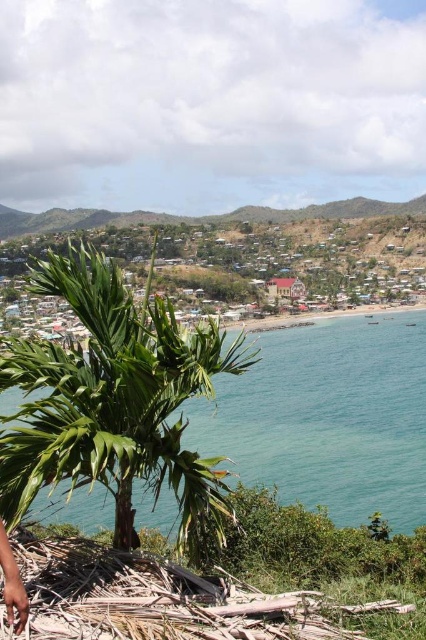
Question: Based on their relative distances, which object is farther from the green leafy palm tree at center?

Choices:
 (A) brown textured palm fronds at lower left
 (B) green grassy hillside at upper center
 (C) green water at center

Answer: (B)

Question: Does green grassy hillside at upper center come behind brown textured palm fronds at lower left?

Choices:
 (A) yes
 (B) no

Answer: (A)

Question: Is the position of green water at center less distant than that of green grassy hillside at upper center?

Choices:
 (A) no
 (B) yes

Answer: (B)

Question: Which point is farther to the camera?

Choices:
 (A) (259, 467)
 (B) (383, 205)
 (C) (175, 320)
 (D) (13, 589)

Answer: (B)

Question: Among these objects, which one is farthest from the camera?

Choices:
 (A) green water at center
 (B) green leafy palm tree at center
 (C) green grassy hillside at upper center
 (D) brown textured palm fronds at lower left

Answer: (C)

Question: Is green leafy palm tree at center above green grassy hillside at upper center?

Choices:
 (A) yes
 (B) no

Answer: (B)